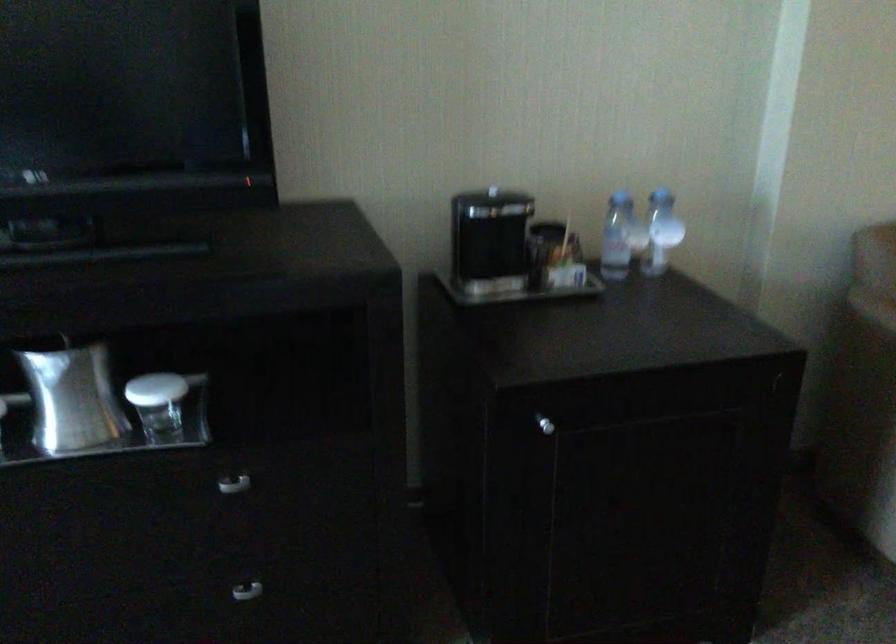
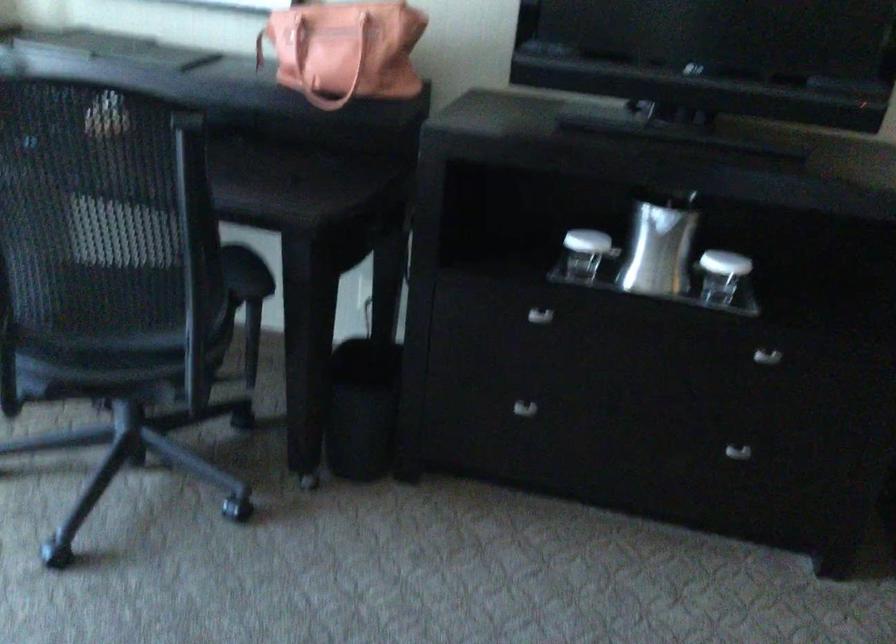
The images are taken continuously from a first-person perspective. In which direction are you moving?

The cameraman walked toward left, backward.